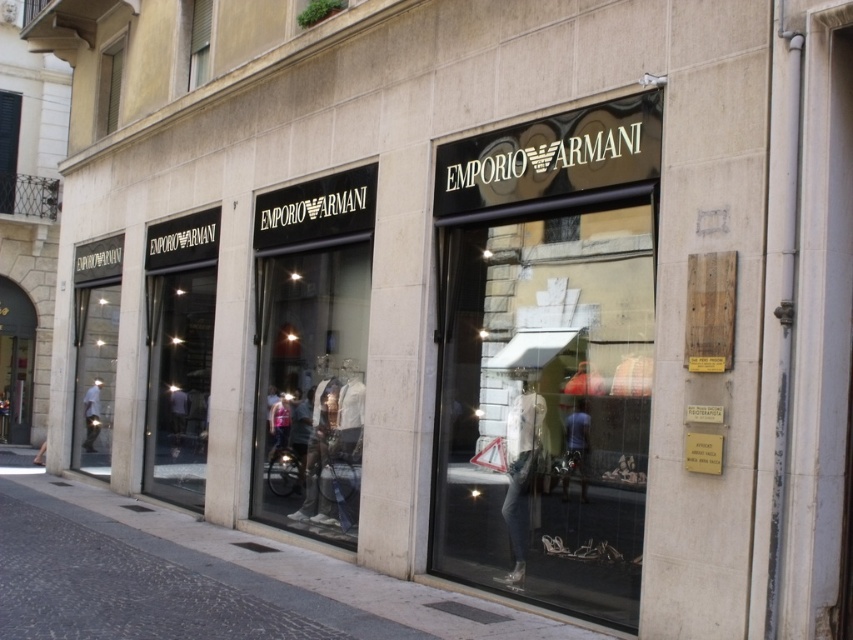
Question: Which object appears closest to the camera in this image?

Choices:
 (A) matte black mannequin at center
 (B) white matte mannequin at left
 (C) transparent glass at center
 (D) gray concrete pavement at lower left

Answer: (D)

Question: Does gray concrete pavement at lower left have a lesser width compared to matte black mannequin at center?

Choices:
 (A) no
 (B) yes

Answer: (A)

Question: Is denim jeans at center positioned in front of matte black mannequin at center?

Choices:
 (A) no
 (B) yes

Answer: (A)

Question: Which object appears closest to the camera in this image?

Choices:
 (A) gray concrete pavement at lower left
 (B) transparent glass at center

Answer: (A)

Question: Estimate the real-world distances between objects in this image. Which object is farther from the transparent glass mannequins at center?

Choices:
 (A) matte black mannequin at center
 (B) denim jeans at center
 (C) transparent glass at center

Answer: (A)

Question: Where is transparent glass door at center located in relation to denim jeans at center in the image?

Choices:
 (A) below
 (B) above

Answer: (B)